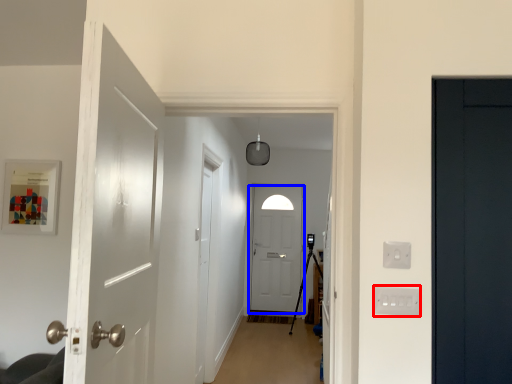
Question: Which object is further to the camera taking this photo, electric outlet (highlighted by a red box) or door (highlighted by a blue box)?

Choices:
 (A) electric outlet
 (B) door

Answer: (B)